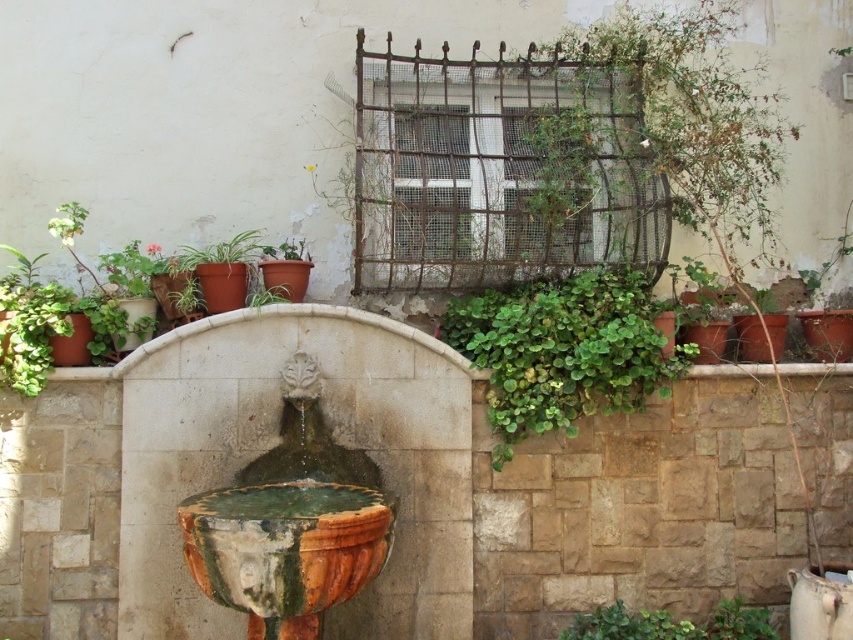
Can you confirm if green leafy plant at lower center is wider than green matte leafy plant at upper left?

Indeed, green leafy plant at lower center has a greater width compared to green matte leafy plant at upper left.

Does green leafy plant at lower center have a larger size compared to green matte leafy plant at upper left?

Incorrect, green leafy plant at lower center is not larger than green matte leafy plant at upper left.

Does point (694, 625) come behind point (126, 296)?

That is False.

Find the location of a particular element. The width and height of the screenshot is (853, 640). green leafy plant at lower center is located at coordinates (630, 625).

Can you confirm if matte terracotta pot at center is shorter than green leafy plant at lower right?

Incorrect, matte terracotta pot at center's height does not fall short of green leafy plant at lower right's.

Can you confirm if matte terracotta pot at center is positioned to the right of green leafy plant at lower right?

Incorrect, matte terracotta pot at center is not on the right side of green leafy plant at lower right.

Is point (79, 262) closer to viewer compared to point (762, 614)?

No, it is behind (762, 614).

Find the location of a particular element. The image size is (853, 640). matte terracotta pot at center is located at coordinates (57, 324).

Can you confirm if green leafy plant at center is thinner than matte terracotta pot at center?

In fact, green leafy plant at center might be wider than matte terracotta pot at center.

Is green leafy plant at center wider than matte terracotta pot at center?

Yes.

What do you see at coordinates (561, 349) in the screenshot? I see `green leafy plant at center` at bounding box center [561, 349].

Find the location of a particular element. green leafy plant at center is located at coordinates (561, 349).